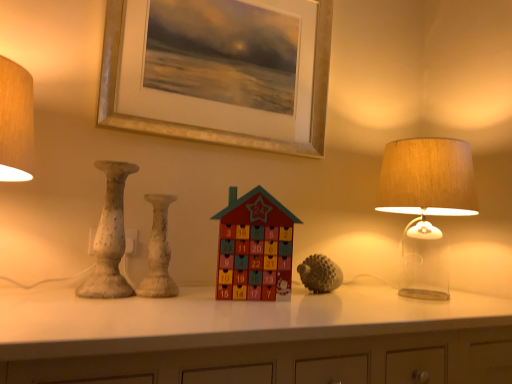
Question: Is textured gray hedgehog at center, positioned as the first toy in right-to-left order, to the left of white speckled vase at center, placed as the first vase when sorted from right to left, from the viewer's perspective?

Choices:
 (A) yes
 (B) no

Answer: (B)

Question: Considering the relative positions of textured gray hedgehog at center, the 2th toy viewed from the left, and white speckled vase at center, placed as the first vase when sorted from right to left, in the image provided, is textured gray hedgehog at center, the 2th toy viewed from the left, behind white speckled vase at center, placed as the first vase when sorted from right to left,?

Choices:
 (A) no
 (B) yes

Answer: (B)

Question: Considering the relative sizes of textured gray hedgehog at center, positioned as the second toy in front-to-back order, and white speckled vase at center, placed as the first vase when sorted from right to left, in the image provided, is textured gray hedgehog at center, positioned as the second toy in front-to-back order, thinner than white speckled vase at center, placed as the first vase when sorted from right to left,?

Choices:
 (A) no
 (B) yes

Answer: (A)

Question: Would you say white speckled vase at center, which appears as the second vase when viewed from the left, is part of textured gray hedgehog at center, the 2th toy viewed from the left,'s contents?

Choices:
 (A) yes
 (B) no

Answer: (B)

Question: Is textured gray hedgehog at center, the 2th toy viewed from the left, far from white speckled vase at center, which appears as the second vase when viewed from the left?

Choices:
 (A) yes
 (B) no

Answer: (B)

Question: Does textured gray hedgehog at center, positioned as the second toy in front-to-back order, have a lesser height compared to white speckled vase at center, placed as the first vase when sorted from right to left?

Choices:
 (A) no
 (B) yes

Answer: (B)

Question: Is textured gray hedgehog at center, placed as the 1th toy when sorted from back to front, behind wooden advent calendar at center, acting as the first toy starting from the front?

Choices:
 (A) no
 (B) yes

Answer: (B)

Question: Can you confirm if textured gray hedgehog at center, positioned as the second toy in front-to-back order, is positioned to the right of wooden advent calendar at center, which ranks as the second toy in back-to-front order?

Choices:
 (A) yes
 (B) no

Answer: (A)

Question: Would you say wooden advent calendar at center, which ranks as the second toy in back-to-front order, is part of textured gray hedgehog at center, placed as the 1th toy when sorted from back to front,'s contents?

Choices:
 (A) no
 (B) yes

Answer: (A)

Question: Considering the relative sizes of textured gray hedgehog at center, positioned as the second toy in front-to-back order, and wooden advent calendar at center, which ranks as the second toy in back-to-front order, in the image provided, is textured gray hedgehog at center, positioned as the second toy in front-to-back order, thinner than wooden advent calendar at center, which ranks as the second toy in back-to-front order,?

Choices:
 (A) yes
 (B) no

Answer: (B)

Question: Is textured gray hedgehog at center, positioned as the second toy in front-to-back order, taller than wooden advent calendar at center, acting as the first toy starting from the front?

Choices:
 (A) yes
 (B) no

Answer: (B)

Question: Considering the relative positions of textured gray hedgehog at center, positioned as the second toy in front-to-back order, and wooden advent calendar at center, the second toy from the right, in the image provided, is textured gray hedgehog at center, positioned as the second toy in front-to-back order, to the left of wooden advent calendar at center, the second toy from the right, from the viewer's perspective?

Choices:
 (A) yes
 (B) no

Answer: (B)

Question: From a real-world perspective, is white speckled vase at center, which appears as the second vase when viewed from the left, below textured gray hedgehog at center, the 2th toy viewed from the left?

Choices:
 (A) no
 (B) yes

Answer: (A)